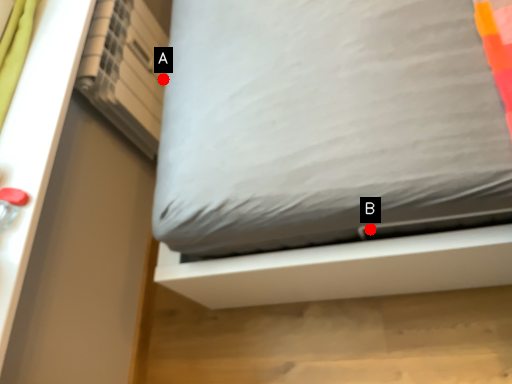
Question: Two points are circled on the image, labeled by A and B beside each circle. Which point is closer to the camera?

Choices:
 (A) A is closer
 (B) B is closer

Answer: (B)